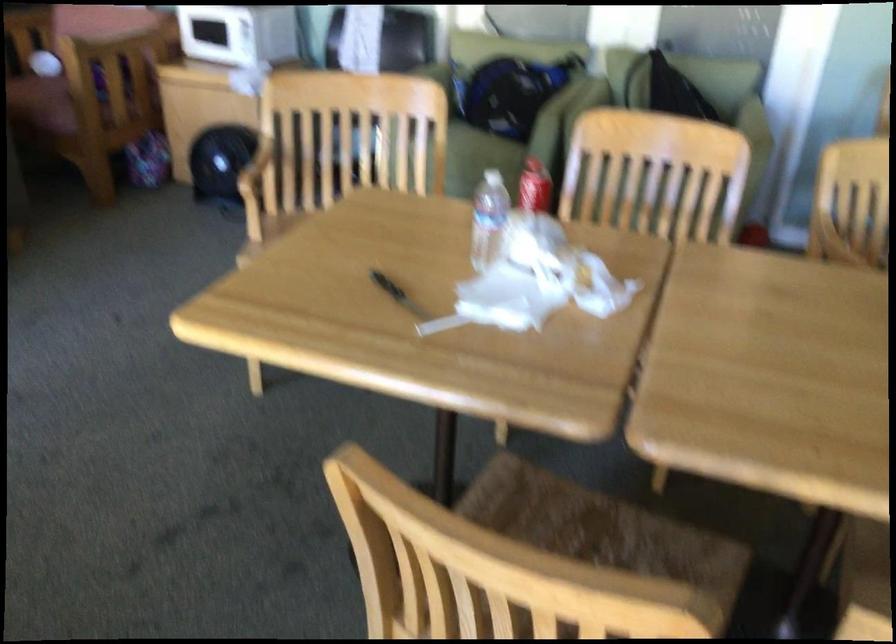
The height and width of the screenshot is (644, 896). What are the coordinates of `chair armrest` in the screenshot? It's located at (255, 166).